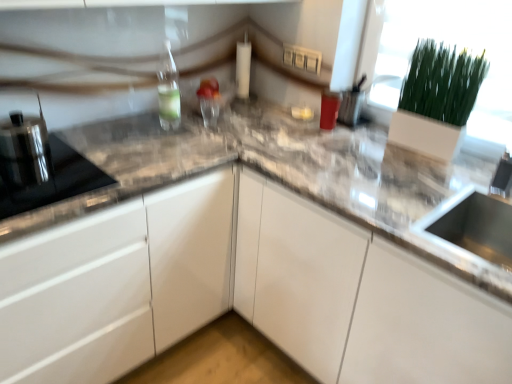
The image size is (512, 384). Identify the location of vacant region to the left of white matte glass door at upper right. (380, 153).